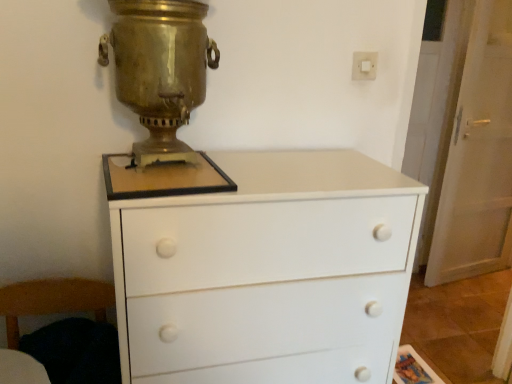
Question: From a real-world perspective, is white plastic switch at upper right positioned over white glossy door at right based on gravity?

Choices:
 (A) no
 (B) yes

Answer: (B)

Question: Is white plastic switch at upper right completely or partially outside of white glossy door at right?

Choices:
 (A) yes
 (B) no

Answer: (A)

Question: Is white plastic switch at upper right turned away from white glossy door at right?

Choices:
 (A) no
 (B) yes

Answer: (A)

Question: Is white plastic switch at upper right at the left side of white glossy door at right?

Choices:
 (A) yes
 (B) no

Answer: (A)

Question: From the image's perspective, would you say white plastic switch at upper right is shown under white glossy door at right?

Choices:
 (A) no
 (B) yes

Answer: (A)

Question: Is white plastic switch at upper right wider than white glossy door at right?

Choices:
 (A) no
 (B) yes

Answer: (A)

Question: From the image's perspective, would you say gold polished samovar at center is positioned over wooden armchair at lower left?

Choices:
 (A) no
 (B) yes

Answer: (B)

Question: Considering the relative sizes of gold polished samovar at center and wooden armchair at lower left in the image provided, is gold polished samovar at center shorter than wooden armchair at lower left?

Choices:
 (A) yes
 (B) no

Answer: (B)

Question: Does gold polished samovar at center touch wooden armchair at lower left?

Choices:
 (A) yes
 (B) no

Answer: (B)

Question: Does gold polished samovar at center have a greater width compared to wooden armchair at lower left?

Choices:
 (A) no
 (B) yes

Answer: (A)

Question: Can you confirm if gold polished samovar at center is bigger than wooden armchair at lower left?

Choices:
 (A) yes
 (B) no

Answer: (B)

Question: Is gold polished samovar at center completely or partially outside of wooden armchair at lower left?

Choices:
 (A) no
 (B) yes

Answer: (B)

Question: Can you confirm if white plastic switch at upper right is wider than gold polished samovar at center?

Choices:
 (A) yes
 (B) no

Answer: (B)